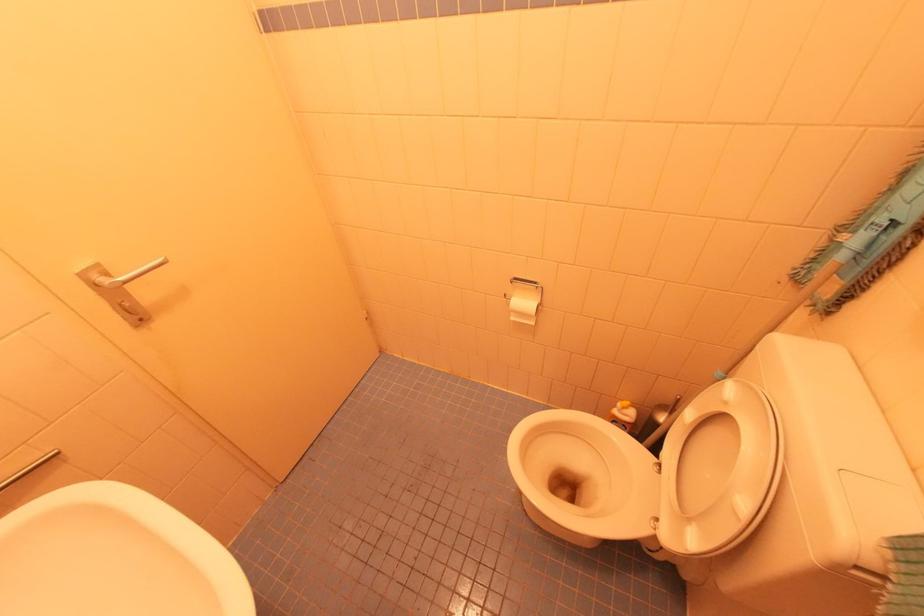
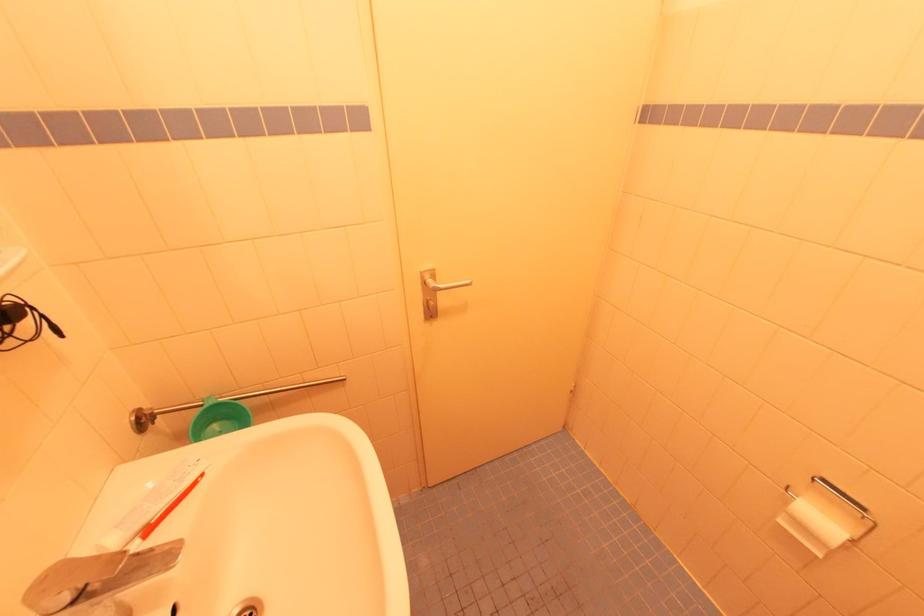
Locate, in the second image, the point that corresponds to (514,318) in the first image.

(784, 523)